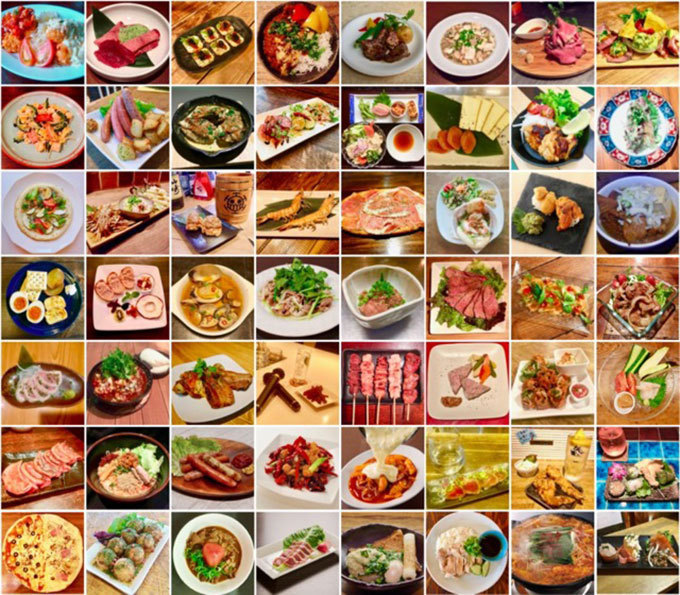
Where is `last row of pictures`? last row of pictures is located at coordinates (48, 538), (120, 547), (198, 551), (267, 554), (353, 552), (447, 560), (538, 554), (634, 555).